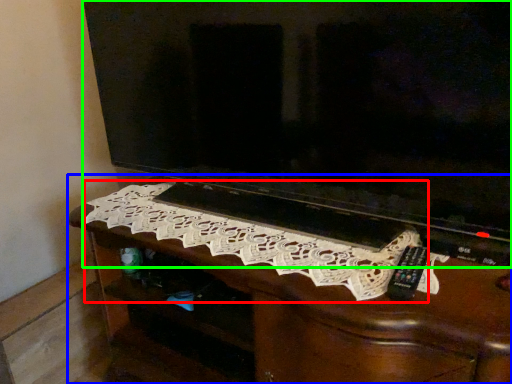
Question: Based on their relative distances, which object is farther from embroidery (highlighted by a red box)? Choose from furniture (highlighted by a blue box) and television (highlighted by a green box).

Choices:
 (A) furniture
 (B) television

Answer: (B)